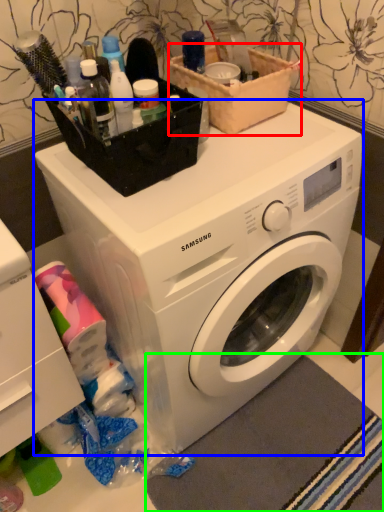
Question: Which object is the closest to the basket (highlighted by a red box)? Choose among these: washing machine (highlighted by a blue box) or bath mat (highlighted by a green box).

Choices:
 (A) washing machine
 (B) bath mat

Answer: (A)